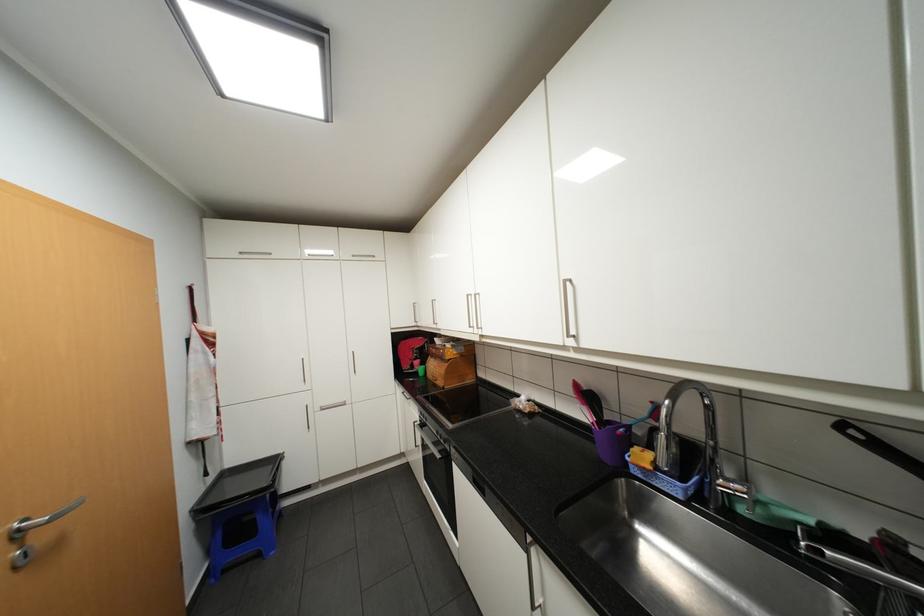
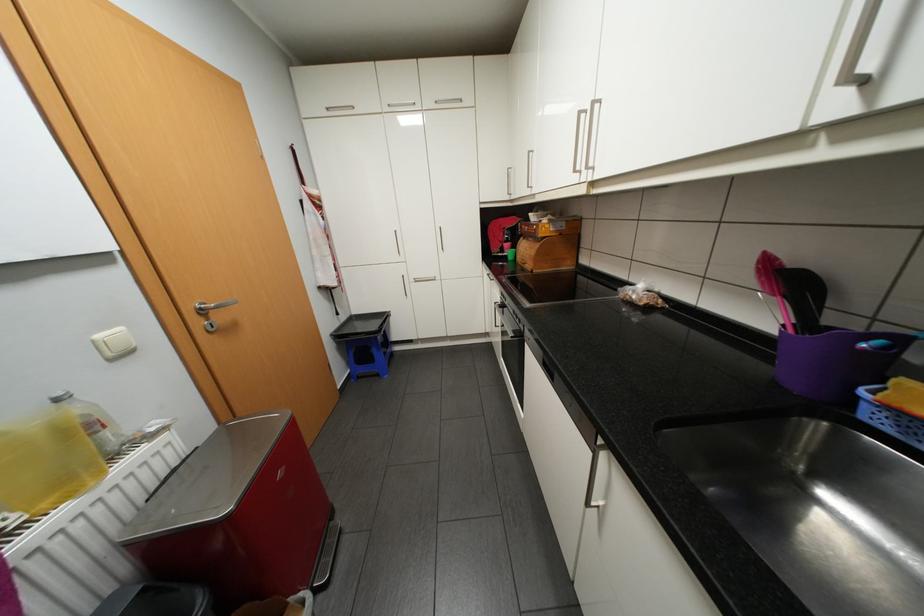
In the second image, find the point that corresponds to pixel 440 355 in the first image.

(531, 237)